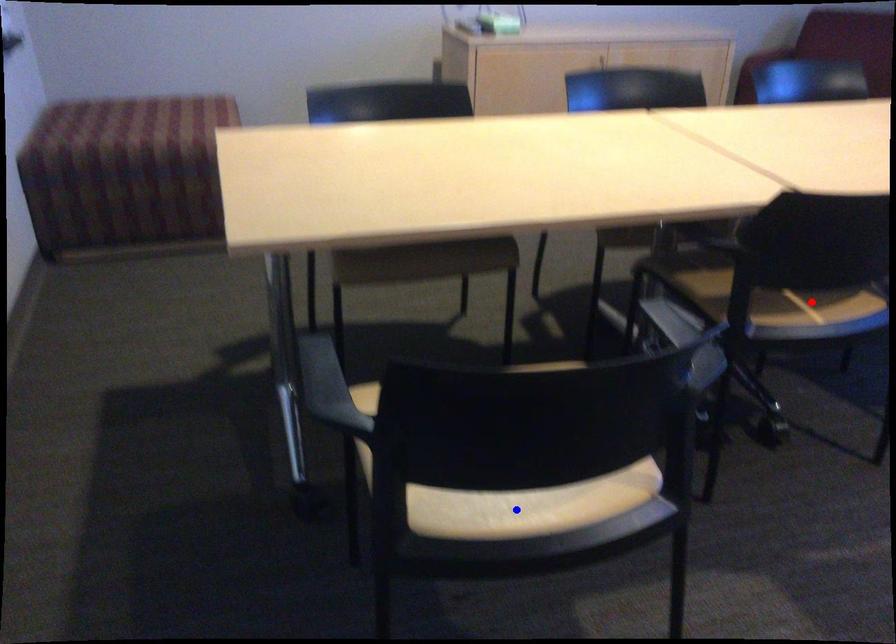
Question: In the image, two points are highlighted. Which point is nearer to the camera? Reply with the corresponding letter.

Choices:
 (A) blue point
 (B) red point

Answer: (A)